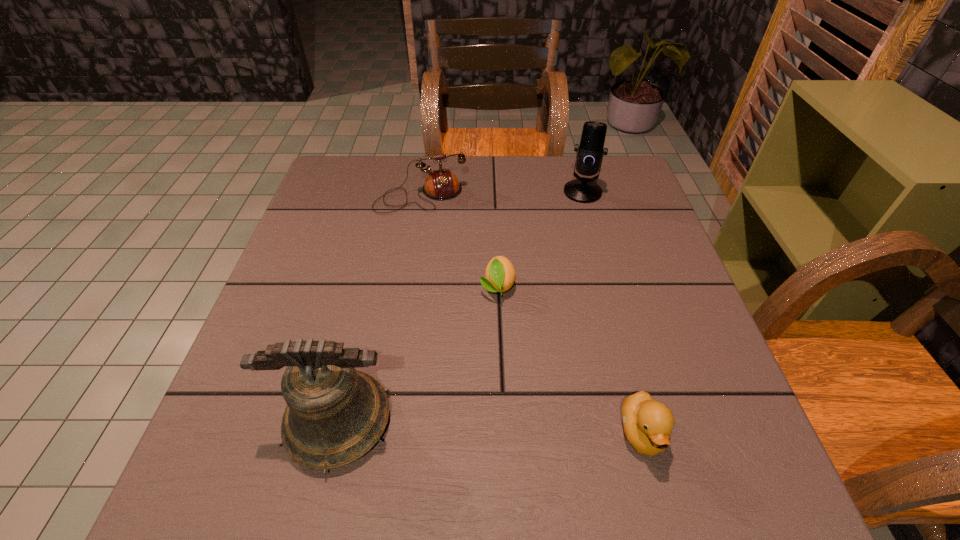
Locate an element on the screen. object present at the left edge is located at coordinates (335, 414).

Where is `duckling that is at the right edge`? This screenshot has width=960, height=540. duckling that is at the right edge is located at coordinates (647, 423).

What are the coordinates of `microphone present at the right edge` in the screenshot? It's located at (590, 152).

Where is `object positioned at the near left corner`? object positioned at the near left corner is located at coordinates (335, 414).

Where is `object situated at the far right corner`? Image resolution: width=960 pixels, height=540 pixels. object situated at the far right corner is located at coordinates (590, 152).

This screenshot has width=960, height=540. What are the coordinates of `object that is at the near right corner` in the screenshot? It's located at (647, 423).

The height and width of the screenshot is (540, 960). I want to click on vacant space at the far edge of the desktop, so point(523,157).

In the image, there is a desktop. Where is `vacant region at the left edge`? vacant region at the left edge is located at coordinates (359, 244).

Where is `vacant position at the right edge of the desktop`? vacant position at the right edge of the desktop is located at coordinates (599, 232).

Locate an element on the screen. This screenshot has width=960, height=540. free space at the near left corner is located at coordinates (249, 401).